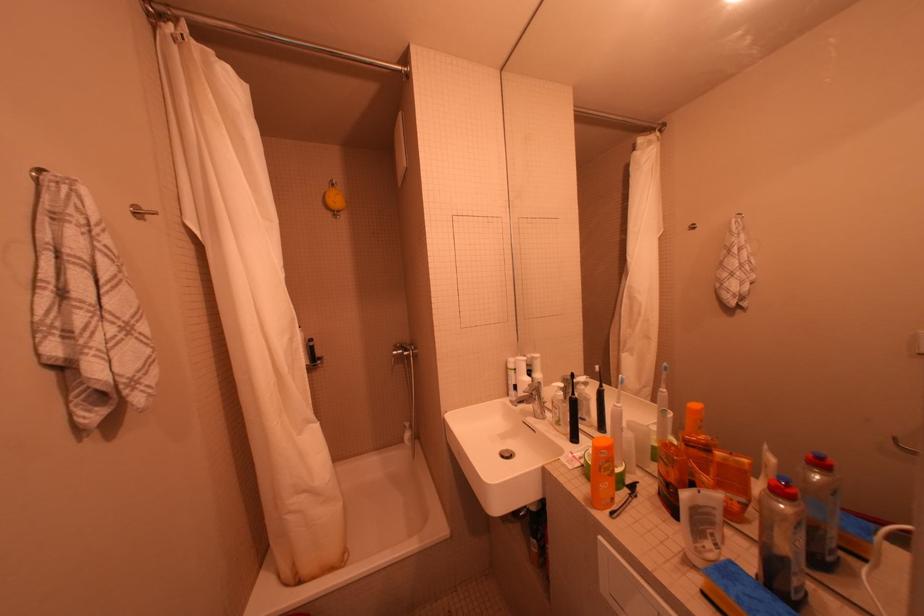
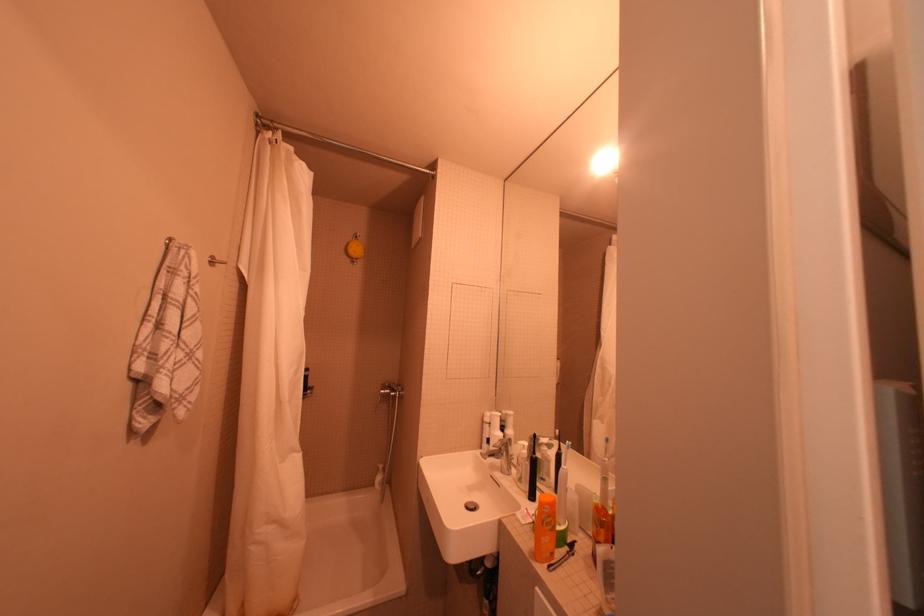
The point at (614, 464) is marked in the first image. Where is the corresponding point in the second image?

(556, 517)